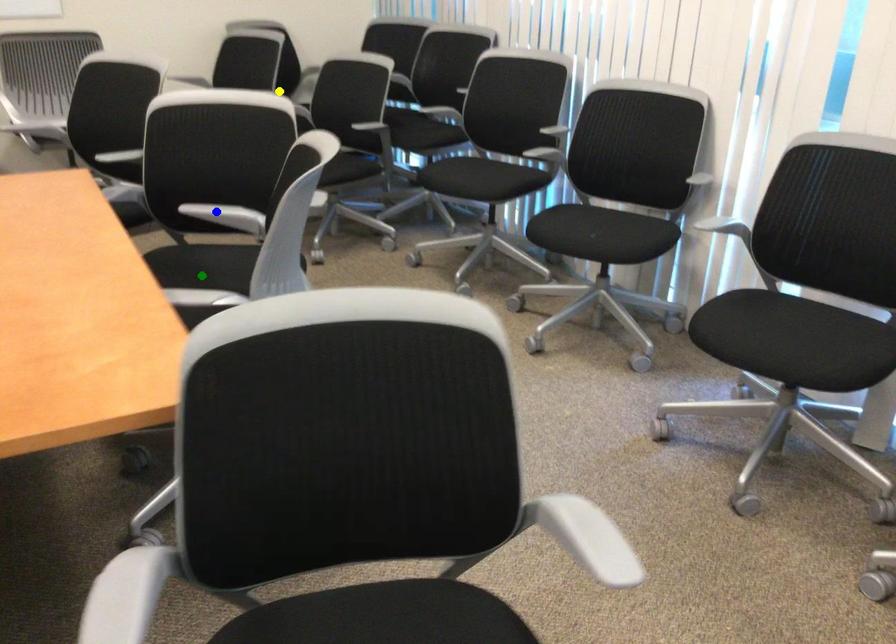
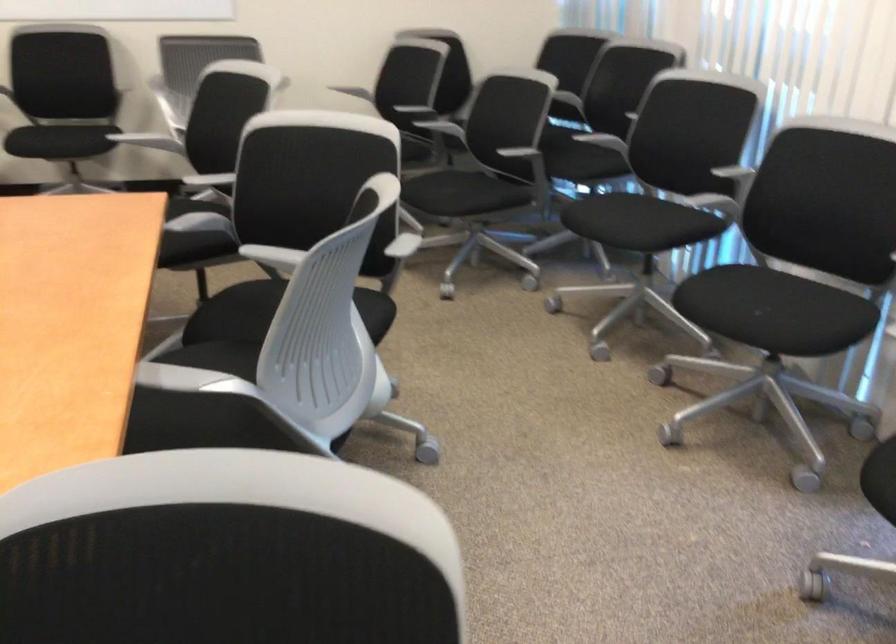
I am providing you with two images of the same scene from different viewpoints. Three points are marked in image1. Which point corresponds to a part or object that is occluded in image2?In image1, three points are marked. Which of them correspond to a part or object that is occluded in image2?Among the three points shown in image1, which one corresponds to a part or object that is no longer visible due to occlusion in image2?

green point